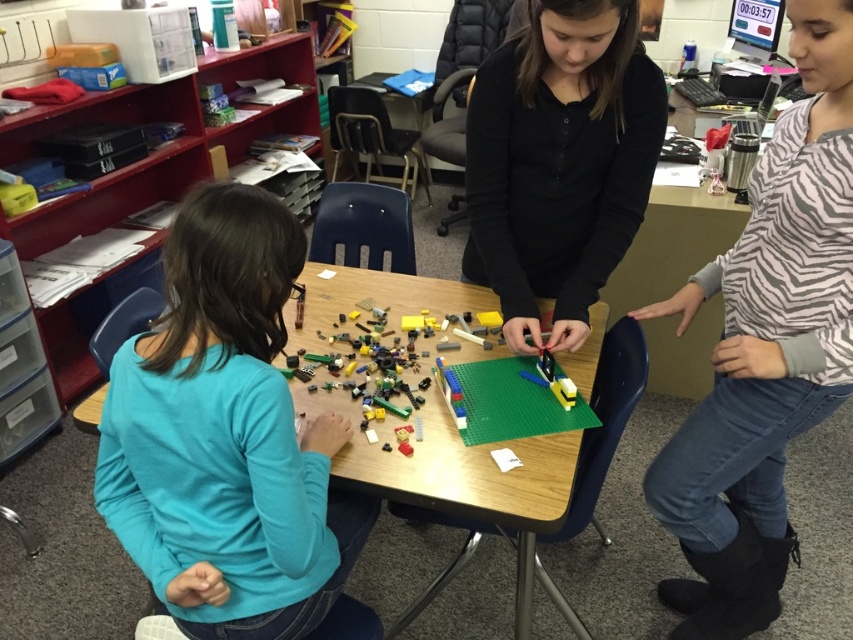
You are standing in front of the LEGO construction table and want to reach both points marked on the table. Which point, point (769, 365) or point (558, 116), is closer to you?

Point (769, 365) is closer to you than point (558, 116) because it is closer to the camera.